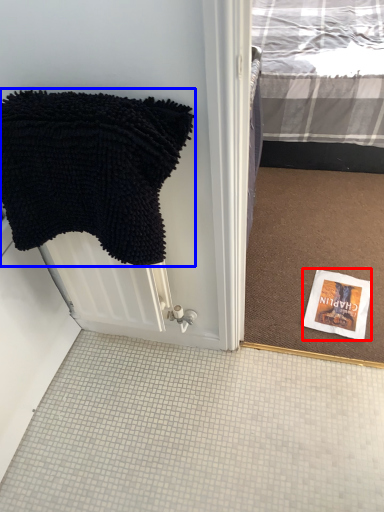
Question: Which object appears closest to the camera in this image, book cover (highlighted by a red box) or towel (highlighted by a blue box)?

Choices:
 (A) book cover
 (B) towel

Answer: (B)